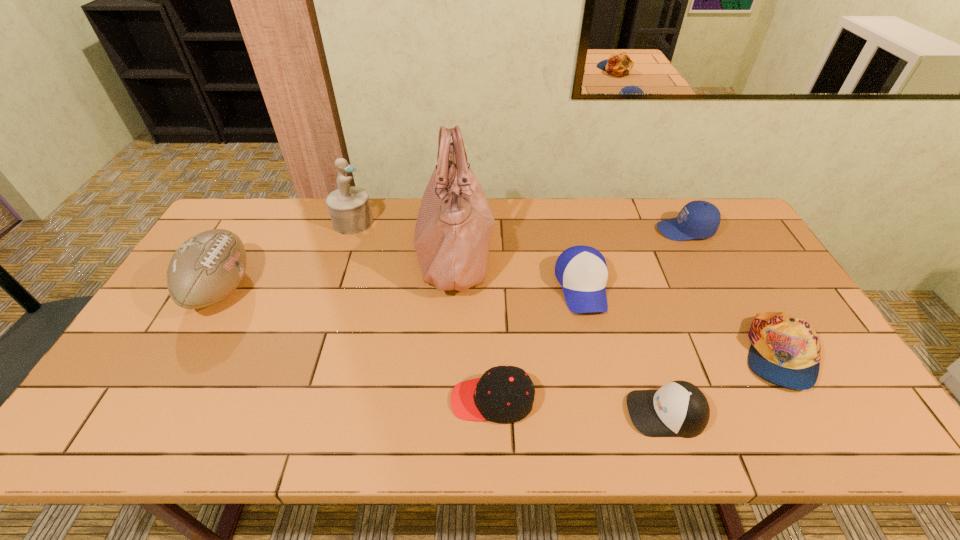
Image resolution: width=960 pixels, height=540 pixels. Identify the location of handbag. (454, 226).

Image resolution: width=960 pixels, height=540 pixels. In order to click on figurine in this screenshot , I will do `click(349, 207)`.

Locate an element on the screen. The width and height of the screenshot is (960, 540). the seventh shortest object is located at coordinates (349, 207).

You are a GUI agent. You are given a task and a screenshot of the screen. Output one action in this format:
    pyautogui.click(x=<x>, y=<y>)
    Task: Click on the sixth shortest object
    
    Given the screenshot: What is the action you would take?
    pyautogui.click(x=209, y=266)

The image size is (960, 540). Find the location of `the leftmost object`. the leftmost object is located at coordinates (209, 266).

The height and width of the screenshot is (540, 960). Find the location of `the farthest cap`. the farthest cap is located at coordinates (698, 219).

The height and width of the screenshot is (540, 960). Identify the location of baseball cap. (582, 272).

You are a GUI agent. You are given a task and a screenshot of the screen. Output one action in this format:
    pyautogui.click(x=<x>, y=<y>)
    Task: Click on the leftmost cap
    
    Given the screenshot: What is the action you would take?
    pyautogui.click(x=503, y=394)

The image size is (960, 540). What are the coordinates of `the third cap from right to left` in the screenshot? It's located at (678, 409).

Identify the location of free region located at the front of the handbag with handles. The width and height of the screenshot is (960, 540). (556, 252).